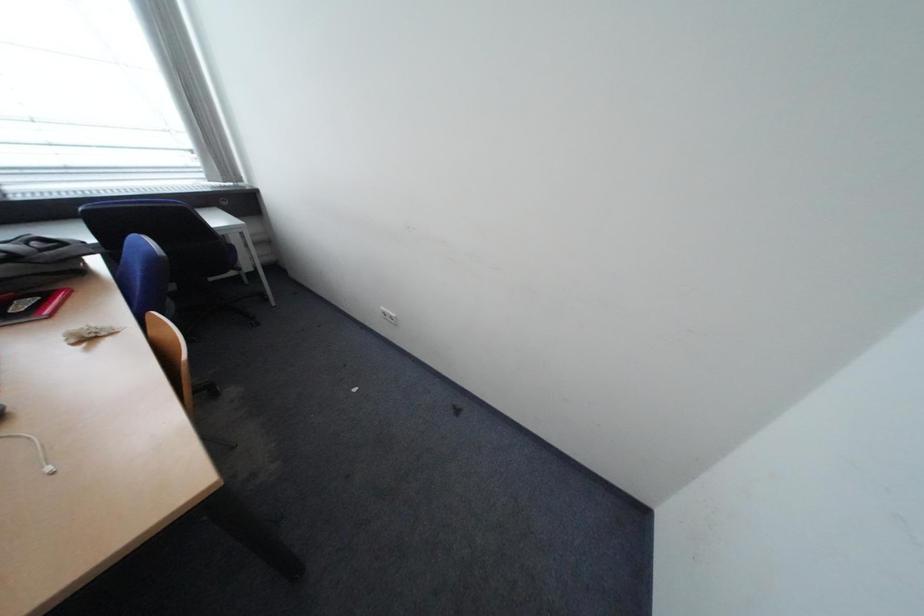
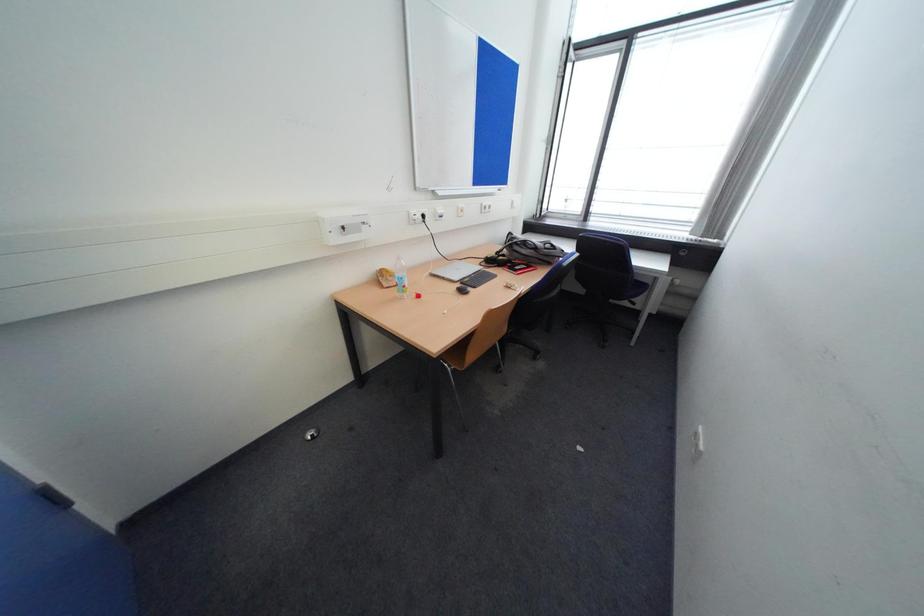
How did the camera likely rotate?

The rotation direction of the camera is left-down.